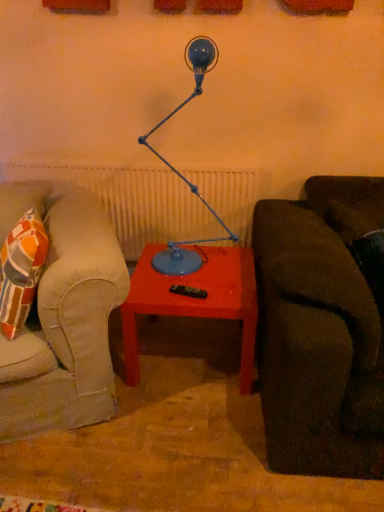
You are a GUI agent. You are given a task and a screenshot of the screen. Output one action in this format:
    pyautogui.click(x=<x>, y=<y>)
    Task: Click on the blue matte table lamp at center
    This screenshot has height=512, width=384.
    Given the screenshot: What is the action you would take?
    pyautogui.click(x=179, y=172)

What do you see at coordinates (179, 172) in the screenshot? The height and width of the screenshot is (512, 384). I see `blue matte table lamp at center` at bounding box center [179, 172].

Measure the distance between point (254, 329) and camera.

Point (254, 329) and camera are 5.97 feet apart from each other.

Where is `matte red table at center`? Image resolution: width=384 pixels, height=512 pixels. matte red table at center is located at coordinates pyautogui.click(x=195, y=301).

Describe the element at coordinates (195, 301) in the screenshot. I see `matte red table at center` at that location.

Identify the location of blue matte table lamp at center. This screenshot has height=512, width=384. (179, 172).

Is blue matte table lamp at center at the right side of matte red table at center?

In fact, blue matte table lamp at center is to the left of matte red table at center.

Is blue matte table lamp at center behind matte red table at center?

No, blue matte table lamp at center is closer to the viewer.

Is point (173, 247) closer or farther from the camera than point (171, 277)?

Point (173, 247) is positioned farther from the camera compared to point (171, 277).

From the image's perspective, is blue matte table lamp at center on matte red table at center?

Yes, from the image's perspective, blue matte table lamp at center is over matte red table at center.

From a real-world perspective, which is physically below, blue matte table lamp at center or matte red table at center?

matte red table at center is physically lower.

Considering the relative sizes of blue matte table lamp at center and matte red table at center in the image provided, is blue matte table lamp at center thinner than matte red table at center?

Yes, blue matte table lamp at center is thinner than matte red table at center.

Is blue matte table lamp at center taller or shorter than matte red table at center?

blue matte table lamp at center is taller than matte red table at center.

Does blue matte table lamp at center have a smaller size compared to matte red table at center?

Indeed, blue matte table lamp at center has a smaller size compared to matte red table at center.

Is matte red table at center located within blue matte table lamp at center?

No.

Is blue matte table lamp at center positioned far away from matte red table at center?

Actually, blue matte table lamp at center and matte red table at center are a little close together.

In the scene shown: Is blue matte table lamp at center turned away from matte red table at center?

No, blue matte table lamp at center is not facing the opposite direction of matte red table at center.

How different are the orientations of blue matte table lamp at center and matte red table at center in degrees?

0.00141 degrees separate the facing orientations of blue matte table lamp at center and matte red table at center.

Find the location of a particular element. The width and height of the screenshot is (384, 512). table lamp located in front of the matte red table at center is located at coordinates (179, 172).

Is matte red table at center to the right of blue matte table lamp at center from the viewer's perspective?

Yes, matte red table at center is to the right of blue matte table lamp at center.

From the picture: Which is in front, matte red table at center or blue matte table lamp at center?

blue matte table lamp at center.

Considering the points (250, 350) and (179, 256), which point is in front, point (250, 350) or point (179, 256)?

Positioned in front is point (250, 350).

From the image's perspective, is matte red table at center on blue matte table lamp at center?

No, from the image's perspective, matte red table at center is not above blue matte table lamp at center.

Based on the photo, from a real-world perspective, is matte red table at center physically located above or below blue matte table lamp at center?

Clearly, from a real-world perspective, matte red table at center is below blue matte table lamp at center.

Does matte red table at center have a greater width compared to blue matte table lamp at center?

Yes.

Considering the relative sizes of matte red table at center and blue matte table lamp at center in the image provided, is matte red table at center shorter than blue matte table lamp at center?

Yes.

Who is bigger, matte red table at center or blue matte table lamp at center?

matte red table at center.

Is matte red table at center surrounding blue matte table lamp at center?

No, blue matte table lamp at center is not a part of matte red table at center.

Is matte red table at center far away from blue matte table lamp at center?

Actually, matte red table at center and blue matte table lamp at center are a little close together.

Is matte red table at center facing away from blue matte table lamp at center?

That's not correct — matte red table at center is not looking away from blue matte table lamp at center.

The image size is (384, 512). What are the coordinates of `table lamp in front of the matte red table at center` in the screenshot? It's located at 179,172.

I want to click on table behind the blue matte table lamp at center, so [x=195, y=301].

This screenshot has height=512, width=384. I want to click on table below the blue matte table lamp at center (from a real-world perspective), so click(195, 301).